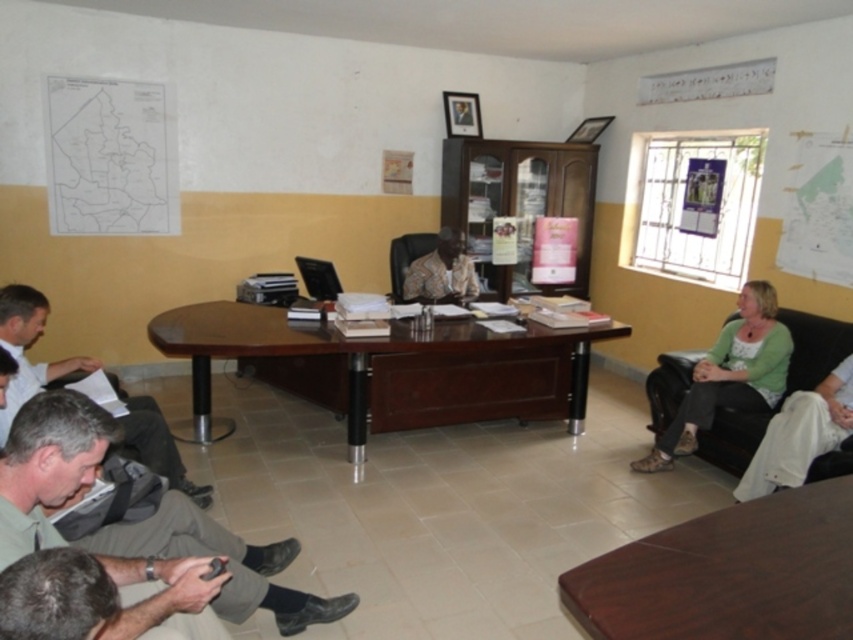
Question: Among these objects, which one is nearest to the camera?

Choices:
 (A) white fabric shirt at lower left
 (B) brown wooden table at lower right
 (C) patterned fabric shirt at center

Answer: (B)

Question: Is green fabric armchair at right in front of patterned fabric shirt at center?

Choices:
 (A) no
 (B) yes

Answer: (B)

Question: Can you confirm if dark brown polished wood round table at center is positioned above green fabric armchair at right?

Choices:
 (A) no
 (B) yes

Answer: (B)

Question: Which object appears closest to the camera in this image?

Choices:
 (A) brown wooden table at lower right
 (B) green fabric armchair at right
 (C) gray fabric pants at lower left
 (D) white fabric shirt at lower left

Answer: (C)

Question: Which point appears farthest from the camera in this image?

Choices:
 (A) (38, 307)
 (B) (392, 333)
 (C) (424, 280)
 (D) (811, 512)

Answer: (C)

Question: Where is brown wooden table at lower right located in relation to patterned fabric shirt at center in the image?

Choices:
 (A) left
 (B) right

Answer: (B)